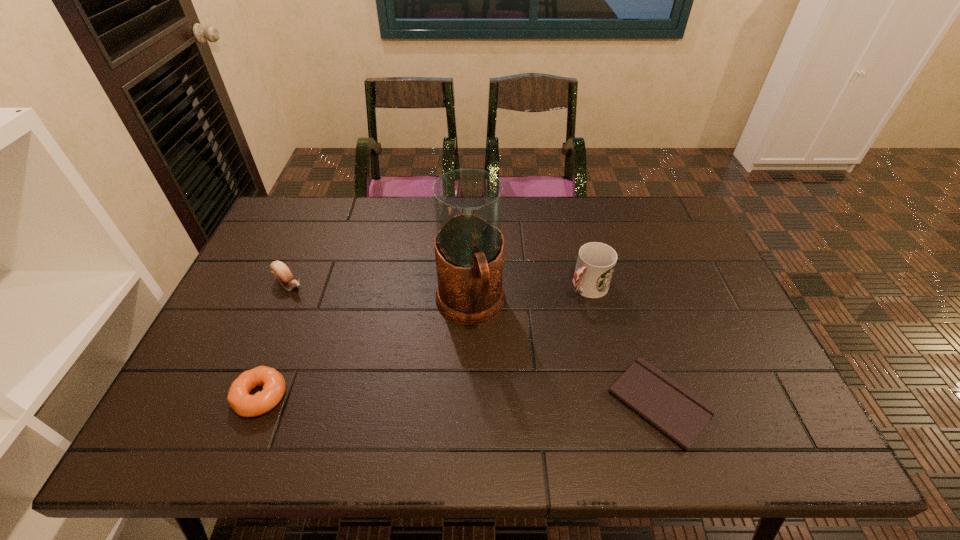
Identify the location of vacant point located on the side of the cup where the handle is located. Image resolution: width=960 pixels, height=540 pixels. [x=510, y=350].

At what (x,y) coordinates should I click in order to perform the action: click on vacant area situated 0.270m on the front-facing side of the third tallest object. Please return your answer as a coordinate pair (x, y). This screenshot has width=960, height=540. Looking at the image, I should click on (366, 338).

The width and height of the screenshot is (960, 540). In order to click on free space located on the front-facing side of the third tallest object in this screenshot , I will do `click(315, 301)`.

You are a GUI agent. You are given a task and a screenshot of the screen. Output one action in this format:
    pyautogui.click(x=<x>, y=<y>)
    Task: Click on the vacant point located 0.290m on the front-facing side of the third tallest object
    This screenshot has height=540, width=960.
    Given the screenshot: What is the action you would take?
    pyautogui.click(x=371, y=342)

At what (x,y) coordinates should I click in order to perform the action: click on vacant position located with the handle on the side of the third object from right to left. Please return your answer as a coordinate pair (x, y). Looking at the image, I should click on (494, 394).

In order to click on free space located 0.170m with the handle on the side of the third object from right to left in this screenshot , I will do (496, 401).

Locate an element on the screen. vacant space located with the handle on the side of the third object from right to left is located at coordinates (495, 397).

The width and height of the screenshot is (960, 540). I want to click on doughnut that is at the near edge, so click(274, 386).

This screenshot has width=960, height=540. Find the location of `checkbook at the near edge`. checkbook at the near edge is located at coordinates (678, 413).

The height and width of the screenshot is (540, 960). What are the coordinates of `doughnut situated at the left edge` in the screenshot? It's located at (274, 386).